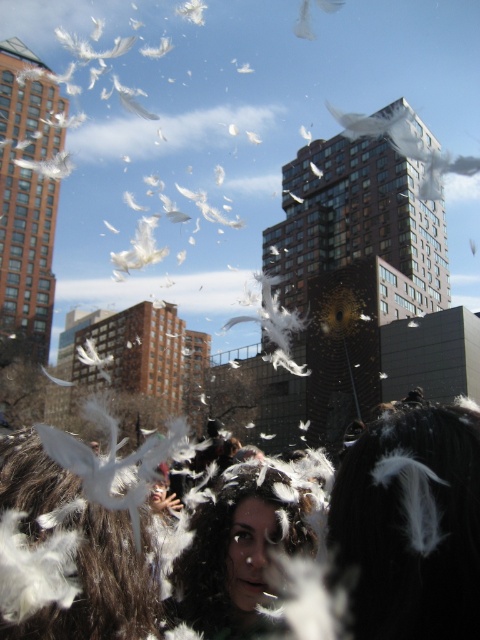
Question: Which point is farther from the camera taking this photo?

Choices:
 (A) tap(230, 486)
 (B) tap(421, 428)
 (C) tap(135, 476)

Answer: (A)

Question: Can you confirm if white feathered hair at center is positioned above white feathered bird at center?

Choices:
 (A) yes
 (B) no

Answer: (A)

Question: Which of the following is the farthest from the observer?

Choices:
 (A) (250, 628)
 (B) (99, 500)
 (C) (478, 435)

Answer: (A)

Question: From the image, what is the correct spatial relationship of white feathered hair at center in relation to white feathered bird at center?

Choices:
 (A) below
 (B) above

Answer: (B)

Question: Does white feathered hair at center come in front of dark brown hair at center?

Choices:
 (A) no
 (B) yes

Answer: (B)

Question: Which object is the farthest from the dark brown hair at center?

Choices:
 (A) white feathered bird at center
 (B) white feathered hair at center

Answer: (B)